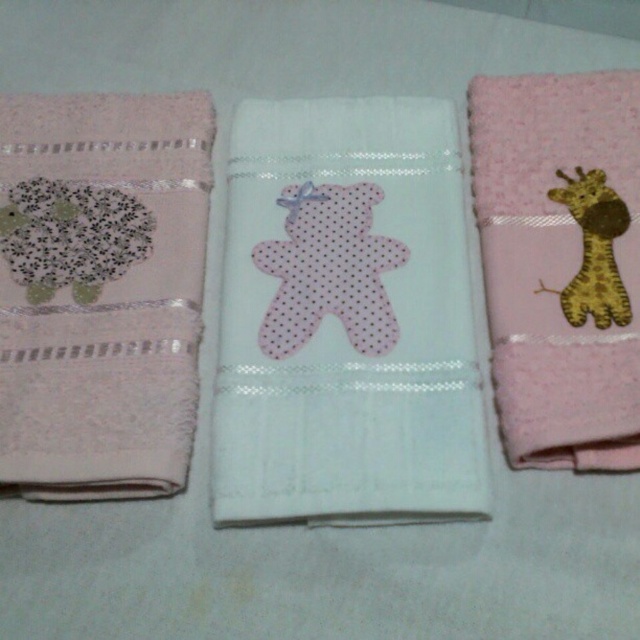
Question: Based on their relative distances, which object is nearer to the pink dotted fabric bear at center?

Choices:
 (A) pink fluffy towel with giraffe at right
 (B) white textured towel with teddy bear at center
 (C) matte pink towel with sheep at left

Answer: (B)

Question: Is white textured towel with teddy bear at center positioned before pink fluffy towel with giraffe at right?

Choices:
 (A) yes
 (B) no

Answer: (A)

Question: Which object is positioned farthest from the pink fluffy towel with giraffe at right?

Choices:
 (A) white textured towel with teddy bear at center
 (B) matte pink towel with sheep at left

Answer: (B)

Question: Among these objects, which one is farthest from the camera?

Choices:
 (A) pink fluffy towel with giraffe at right
 (B) white textured towel with teddy bear at center
 (C) matte pink towel with sheep at left
 (D) pink dotted fabric bear at center

Answer: (D)

Question: In this image, where is white textured towel with teddy bear at center located relative to brown felt giraffe at right?

Choices:
 (A) below
 (B) above

Answer: (A)

Question: Does white textured towel with teddy bear at center have a lesser width compared to matte pink towel with sheep at left?

Choices:
 (A) no
 (B) yes

Answer: (A)